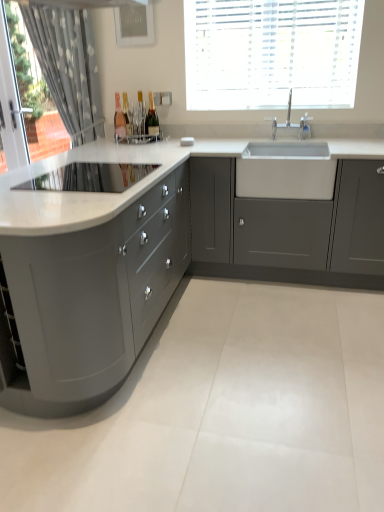
The width and height of the screenshot is (384, 512). Identify the location of gray fabric curtain at left. (68, 66).

What do you see at coordinates (271, 53) in the screenshot?
I see `white textured blinds at upper center` at bounding box center [271, 53].

What do you see at coordinates (292, 124) in the screenshot? The height and width of the screenshot is (512, 384). I see `white ceramic tap at upper center` at bounding box center [292, 124].

How much space does matte glass bottle at upper center, which is the second bottle in left-to-right order, occupy horizontally?

7.96 centimeters.

The width and height of the screenshot is (384, 512). Describe the element at coordinates (285, 178) in the screenshot. I see `white glossy drawer at center` at that location.

The width and height of the screenshot is (384, 512). Find the location of `gray fabric curtain at left`. gray fabric curtain at left is located at coordinates (68, 66).

Can you confirm if matte gray cabinet at center, which appears as the 2th cabinetry when viewed from the left, is taller than white glossy drawer at center?

Indeed, matte gray cabinet at center, which appears as the 2th cabinetry when viewed from the left, has a greater height compared to white glossy drawer at center.

Is matte gray cabinet at center, marked as the first cabinetry in a right-to-left arrangement, completely or partially outside of white glossy drawer at center?

matte gray cabinet at center, marked as the first cabinetry in a right-to-left arrangement, lies outside white glossy drawer at center's area.

Is matte gray cabinet at center, which appears as the 2th cabinetry when viewed from the left, bigger than white glossy drawer at center?

Indeed, matte gray cabinet at center, which appears as the 2th cabinetry when viewed from the left, has a larger size compared to white glossy drawer at center.

Identify the location of cabinetry that is the 1st one when counting downward from the white glossy drawer at center (from the image's perspective). The image size is (384, 512). tap(289, 229).

Can you confirm if white glossy drawer at center is taller than clear glass bottle at center, which ranks as the first bottle in left-to-right order?

No, white glossy drawer at center is not taller than clear glass bottle at center, which ranks as the first bottle in left-to-right order.

Considering the sizes of white glossy drawer at center and clear glass bottle at center, which ranks as the first bottle in left-to-right order, in the image, is white glossy drawer at center wider or thinner than clear glass bottle at center, which ranks as the first bottle in left-to-right order,?

In the image, white glossy drawer at center appears to be wider than clear glass bottle at center, which ranks as the first bottle in left-to-right order.

Which point is more forward, (314, 196) or (122, 117)?

Positioned in front is point (314, 196).

Measure the distance from white glossy drawer at center to clear glass bottle at center, marked as the second bottle in a right-to-left arrangement.

white glossy drawer at center is 4.06 feet away from clear glass bottle at center, marked as the second bottle in a right-to-left arrangement.

How different are the orientations of clear glass bottle at center, marked as the second bottle in a right-to-left arrangement, and matte glass bottle at upper center, which is the second bottle in left-to-right order, in degrees?

clear glass bottle at center, marked as the second bottle in a right-to-left arrangement, and matte glass bottle at upper center, which is the second bottle in left-to-right order, are facing 0.00412 degrees away from each other.

How distant is clear glass bottle at center, which ranks as the first bottle in left-to-right order, from matte glass bottle at upper center, positioned as the first bottle in right-to-left order?

clear glass bottle at center, which ranks as the first bottle in left-to-right order, and matte glass bottle at upper center, positioned as the first bottle in right-to-left order, are 8.25 inches apart.

Does clear glass bottle at center, which ranks as the first bottle in left-to-right order, turn towards matte glass bottle at upper center, positioned as the first bottle in right-to-left order?

No, clear glass bottle at center, which ranks as the first bottle in left-to-right order, is not facing towards matte glass bottle at upper center, positioned as the first bottle in right-to-left order.

Based on the photo, is clear glass bottle at center, marked as the second bottle in a right-to-left arrangement, bigger than matte glass bottle at upper center, which is the second bottle in left-to-right order?

No.

Between point (79, 75) and point (340, 33), which one is positioned behind?

Positioned behind is point (79, 75).

Is gray fabric curtain at left spatially inside white textured blinds at upper center, or outside of it?

gray fabric curtain at left is outside white textured blinds at upper center.

Which object is positioned more to the right, gray fabric curtain at left or white textured blinds at upper center?

white textured blinds at upper center is more to the right.

Between gray fabric curtain at left and white textured blinds at upper center, which one has smaller width?

white textured blinds at upper center.

Is gray fabric curtain at left taller or shorter than matte gray cabinets at left, which is the 1th cabinetry in left-to-right order?

Considering their sizes, gray fabric curtain at left has more height than matte gray cabinets at left, which is the 1th cabinetry in left-to-right order.

In the scene shown: Is matte gray cabinets at left, the 2th cabinetry viewed from the right, located within gray fabric curtain at left?

No, matte gray cabinets at left, the 2th cabinetry viewed from the right, is located outside of gray fabric curtain at left.

Image resolution: width=384 pixels, height=512 pixels. I want to click on cabinetry that is the 1st one when counting rightward from the gray fabric curtain at left, so click(91, 300).

Between point (61, 101) and point (28, 250), which one is positioned behind?

The point (61, 101) is behind.

Is clear glass bottle at center, which ranks as the first bottle in left-to-right order, taller or shorter than matte gray cabinets at left, the 2th cabinetry viewed from the right?

Clearly, clear glass bottle at center, which ranks as the first bottle in left-to-right order, is shorter compared to matte gray cabinets at left, the 2th cabinetry viewed from the right.

Is clear glass bottle at center, which ranks as the first bottle in left-to-right order, facing away from matte gray cabinets at left, the 2th cabinetry viewed from the right?

No.

Is clear glass bottle at center, which ranks as the first bottle in left-to-right order, far away from matte gray cabinets at left, which is the 1th cabinetry in left-to-right order?

Absolutely, clear glass bottle at center, which ranks as the first bottle in left-to-right order, is distant from matte gray cabinets at left, which is the 1th cabinetry in left-to-right order.

Is clear glass bottle at center, marked as the second bottle in a right-to-left arrangement, positioned behind matte gray cabinets at left, the 2th cabinetry viewed from the right?

Yes, clear glass bottle at center, marked as the second bottle in a right-to-left arrangement, is further from the camera.

From a real-world perspective, relative to white glossy drawer at center, is matte glass bottle at upper center, which is the second bottle in left-to-right order, vertically above or below?

matte glass bottle at upper center, which is the second bottle in left-to-right order, is situated higher than white glossy drawer at center in the real world.

Which object is more forward, matte glass bottle at upper center, positioned as the first bottle in right-to-left order, or white glossy drawer at center?

white glossy drawer at center.

Based on the photo, how much distance is there between matte glass bottle at upper center, positioned as the first bottle in right-to-left order, and white glossy drawer at center?

matte glass bottle at upper center, positioned as the first bottle in right-to-left order, and white glossy drawer at center are 1.13 meters apart.

Can you tell me how much matte glass bottle at upper center, positioned as the first bottle in right-to-left order, and white glossy drawer at center differ in facing direction?

The angle between the facing direction of matte glass bottle at upper center, positioned as the first bottle in right-to-left order, and the facing direction of white glossy drawer at center is 1.08 degrees.

What are the coordinates of `cabinetry located on the right of white glossy drawer at center` in the screenshot? It's located at (289, 229).

You are a GUI agent. You are given a task and a screenshot of the screen. Output one action in this format:
    pyautogui.click(x=<x>, y=<y>)
    Task: Click on the 1st bottle behind when counting from the white glossy drawer at center
    
    Given the screenshot: What is the action you would take?
    pyautogui.click(x=119, y=119)

Estimate the real-world distances between objects in this image. Which object is closer to gray fabric curtain at left, white textured blinds at upper center or white glossy drawer at center?

white textured blinds at upper center.

Based on their spatial positions, is white ceramic tap at upper center or clear glass bottle at center, which ranks as the first bottle in left-to-right order, further from matte glass bottle at upper center, positioned as the first bottle in right-to-left order?

white ceramic tap at upper center lies further to matte glass bottle at upper center, positioned as the first bottle in right-to-left order, than the other object.

Estimate the real-world distances between objects in this image. Which object is further from gray fabric curtain at left, white ceramic tap at upper center or clear glass bottle at center, marked as the second bottle in a right-to-left arrangement?

Among the two, white ceramic tap at upper center is located further to gray fabric curtain at left.

Looking at the image, which one is located further to white textured blinds at upper center, matte glass bottle at upper center, which is the second bottle in left-to-right order, or white glossy drawer at center?

Based on the image, white glossy drawer at center appears to be further to white textured blinds at upper center.

When comparing their distances from white textured blinds at upper center, does white glossy drawer at center or matte gray cabinets at left, which is the 1th cabinetry in left-to-right order, seem further?

matte gray cabinets at left, which is the 1th cabinetry in left-to-right order, is positioned further to the anchor white textured blinds at upper center.

Based on the photo, when comparing their distances from matte glass bottle at upper center, which is the second bottle in left-to-right order, does matte gray cabinet at center, marked as the first cabinetry in a right-to-left arrangement, or gray fabric curtain at left seem further?

matte gray cabinet at center, marked as the first cabinetry in a right-to-left arrangement, is further to matte glass bottle at upper center, which is the second bottle in left-to-right order.

Estimate the real-world distances between objects in this image. Which object is closer to gray fabric curtain at left, white textured blinds at upper center or matte gray cabinets at left, which is the 1th cabinetry in left-to-right order?

white textured blinds at upper center is positioned closer to the anchor gray fabric curtain at left.

From the image, which object appears to be farther from matte gray cabinet at center, marked as the first cabinetry in a right-to-left arrangement, matte glass bottle at upper center, positioned as the first bottle in right-to-left order, or white textured blinds at upper center?

matte glass bottle at upper center, positioned as the first bottle in right-to-left order.

You are a GUI agent. You are given a task and a screenshot of the screen. Output one action in this format:
    pyautogui.click(x=<x>, y=<y>)
    Task: Click on the window located between matte glass bottle at upper center, which is the second bottle in left-to-right order, and white glossy drawer at center in the left-right direction
    This screenshot has width=384, height=512.
    Given the screenshot: What is the action you would take?
    pyautogui.click(x=271, y=53)

Find the location of `cabinetry located between matte gray cabinets at left, which is the 1th cabinetry in left-to-right order, and clear glass bottle at center, which ranks as the first bottle in left-to-right order, in the depth direction`. cabinetry located between matte gray cabinets at left, which is the 1th cabinetry in left-to-right order, and clear glass bottle at center, which ranks as the first bottle in left-to-right order, in the depth direction is located at coordinates (289, 229).

Locate an element on the screen. The height and width of the screenshot is (512, 384). tap between matte gray cabinets at left, which is the 1th cabinetry in left-to-right order, and matte glass bottle at upper center, which is the second bottle in left-to-right order, from front to back is located at coordinates (292, 124).

Where is `window located between clear glass bottle at center, which ranks as the first bottle in left-to-right order, and white glossy drawer at center in the left-right direction`? This screenshot has width=384, height=512. window located between clear glass bottle at center, which ranks as the first bottle in left-to-right order, and white glossy drawer at center in the left-right direction is located at coordinates 271,53.